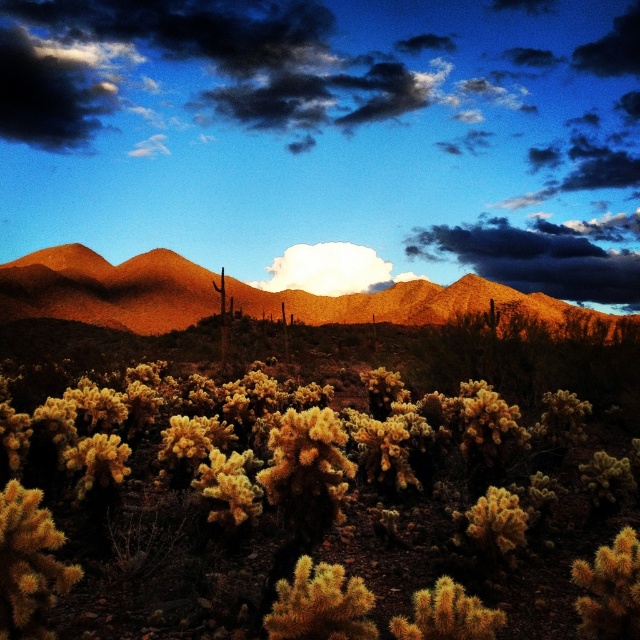
Is rustic brown mountains at upper center wider than dark gray cloud at upper center?

Indeed, rustic brown mountains at upper center has a greater width compared to dark gray cloud at upper center.

Is the position of rustic brown mountains at upper center less distant than that of dark gray cloud at upper center?

That is True.

Image resolution: width=640 pixels, height=640 pixels. What do you see at coordinates (108, 289) in the screenshot?
I see `rustic brown mountains at upper center` at bounding box center [108, 289].

I want to click on rustic brown mountains at upper center, so click(108, 289).